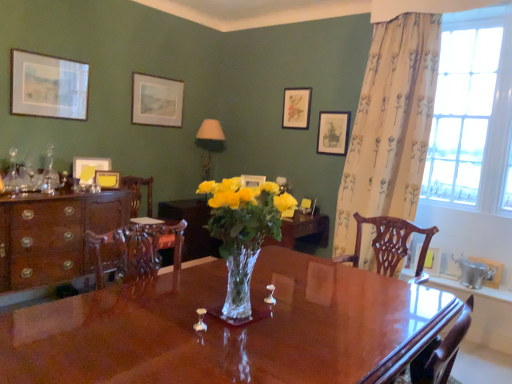
The image size is (512, 384). I want to click on vacant area that is in front of clear glass vase at center, so click(188, 356).